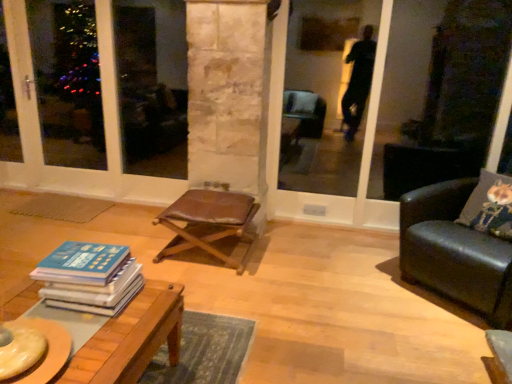
Question: Can you confirm if leather stool at center is positioned to the right of blue hardcover book at lower left?

Choices:
 (A) yes
 (B) no

Answer: (A)

Question: Is leather stool at center to the left of blue hardcover book at lower left from the viewer's perspective?

Choices:
 (A) no
 (B) yes

Answer: (A)

Question: Can you confirm if leather stool at center is shorter than blue hardcover book at lower left?

Choices:
 (A) no
 (B) yes

Answer: (A)

Question: From the image's perspective, would you say leather stool at center is shown under blue hardcover book at lower left?

Choices:
 (A) no
 (B) yes

Answer: (A)

Question: Does leather stool at center have a greater width compared to blue hardcover book at lower left?

Choices:
 (A) yes
 (B) no

Answer: (A)

Question: Looking at the image, does transparent glass door at upper center seem bigger or smaller compared to white glass screen door at left?

Choices:
 (A) small
 (B) big

Answer: (B)

Question: Is point (311, 147) closer or farther from the camera than point (74, 190)?

Choices:
 (A) farther
 (B) closer

Answer: (A)

Question: From a real-world perspective, is transparent glass door at upper center above or below white glass screen door at left?

Choices:
 (A) below
 (B) above

Answer: (B)

Question: Is transparent glass door at upper center inside the boundaries of white glass screen door at left, or outside?

Choices:
 (A) outside
 (B) inside

Answer: (A)

Question: From the image's perspective, relative to wooden table at lower left, is blue hardcover book at lower left above or below?

Choices:
 (A) above
 (B) below

Answer: (A)

Question: Is point (105, 311) closer or farther from the camera than point (147, 331)?

Choices:
 (A) farther
 (B) closer

Answer: (A)

Question: Is blue hardcover book at lower left taller or shorter than wooden table at lower left?

Choices:
 (A) short
 (B) tall

Answer: (A)

Question: Relative to wooden table at lower left, is blue hardcover book at lower left in front or behind?

Choices:
 (A) behind
 (B) front

Answer: (A)

Question: Which is correct: black leather couch at right is inside transparent glass door at upper center, or outside of it?

Choices:
 (A) inside
 (B) outside

Answer: (B)

Question: In terms of height, does black leather couch at right look taller or shorter compared to transparent glass door at upper center?

Choices:
 (A) short
 (B) tall

Answer: (A)